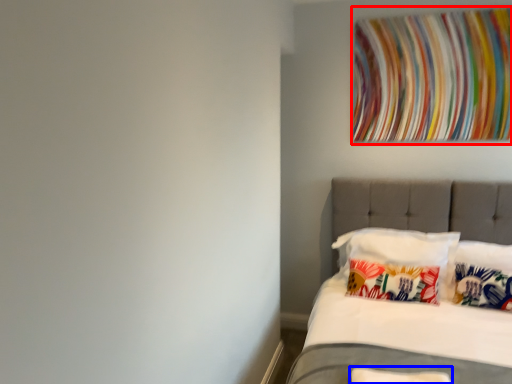
Question: Which object appears closest to the camera in this image, tapestry (highlighted by a red box) or pillow (highlighted by a blue box)?

Choices:
 (A) tapestry
 (B) pillow

Answer: (B)